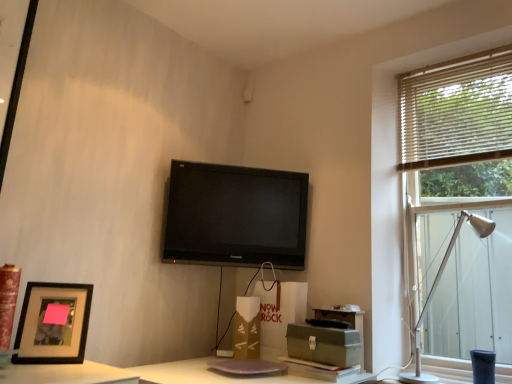
Identify the location of blank space situated above green cardboard box at lower center, arranged as the first cardboard box when viewed from the front (from a real-world perspective). (325, 328).